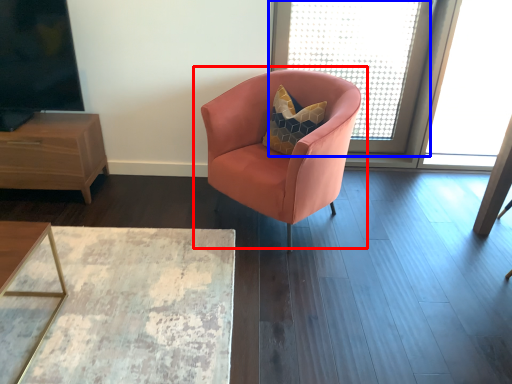
Question: Which point is further to the camera, chair (highlighted by a red box) or window screen (highlighted by a blue box)?

Choices:
 (A) chair
 (B) window screen

Answer: (B)